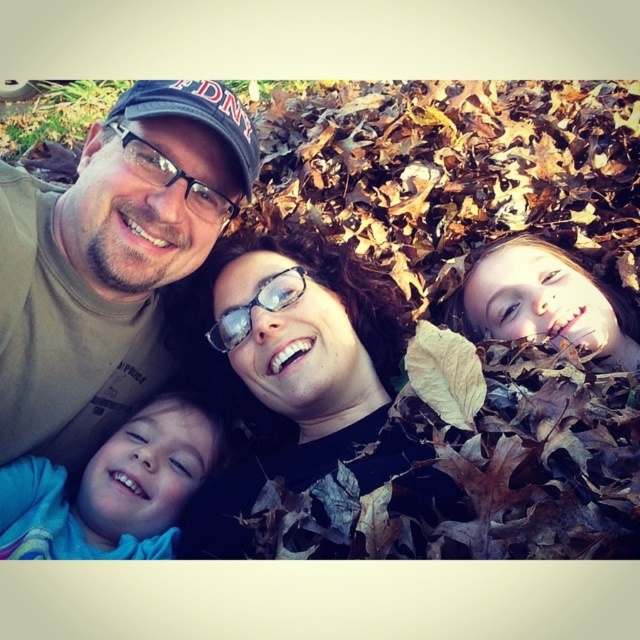
You are an observer looking at the family on the bed of leaves. Which clothing item, the matte khaki shirt at upper left or the blue soft fabric at lower left, is bigger in size?

The matte khaki shirt at upper left is larger in size compared to the blue soft fabric at lower left.

You are standing in front of the scene where the family is lying on the bed of fallen leaves. You want to place a small decoration at the point that is closer to you. Which point should you choose between point (280, 106) and point (216, 131)?

Point (216, 131) is closer to you than point (280, 106), so you should choose point (216, 131) to place the decoration.

You are a photographer trying to capture a closeup of the black matte glasses at center and the matte khaki shirt at upper left. Since you want to focus on both objects equally, which one requires you to adjust your camera to a wider angle to accommodate its size?

The black matte glasses at center requires a wider angle because its width is larger than the matte khaki shirt at upper left.